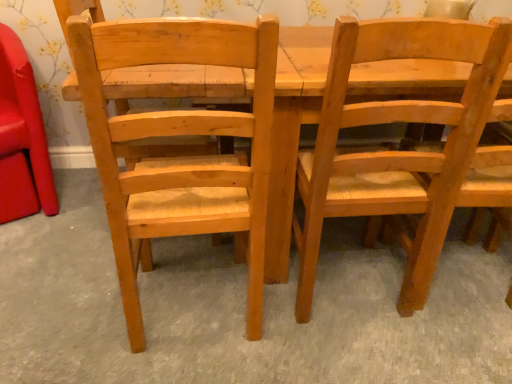
At what (x,y) coordinates should I click in order to perform the action: click on free area below light brown wood chair at center, acting as the first chair starting from the right (from a real-world perspective). Please return your answer as a coordinate pair (x, y). Looking at the image, I should click on (348, 282).